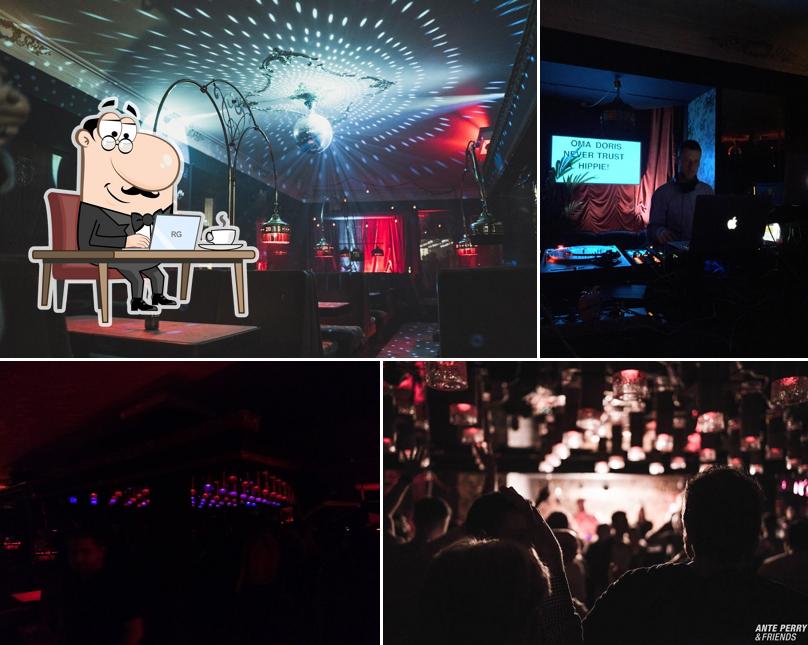
I want to click on table, so click(188, 255).